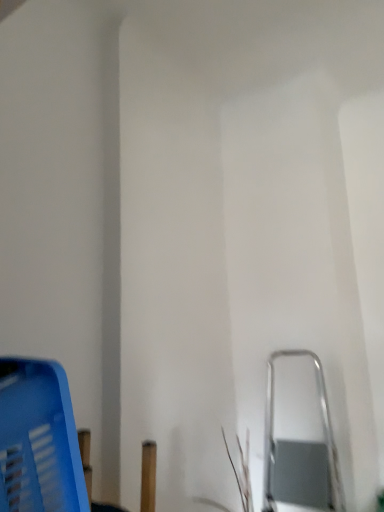
The height and width of the screenshot is (512, 384). In order to click on blue plastic basket at lower left in this screenshot , I will do `click(38, 440)`.

Describe the element at coordinates (38, 440) in the screenshot. I see `blue plastic basket at lower left` at that location.

The width and height of the screenshot is (384, 512). Find the location of `blue plastic basket at lower left`. blue plastic basket at lower left is located at coordinates (38, 440).